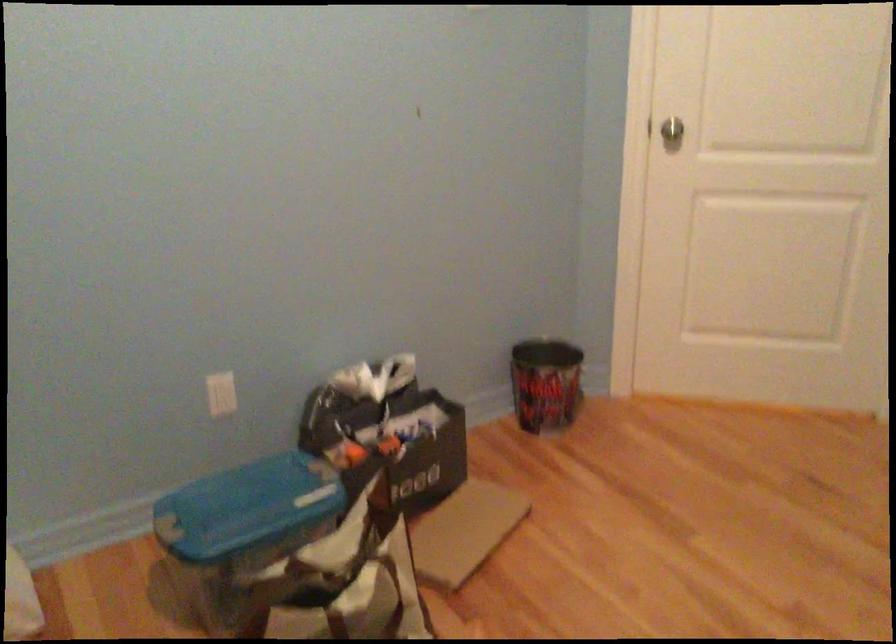
Where would you lift the patterned trash bin? Please return your answer as a coordinate pair (x, y).

(545, 383)